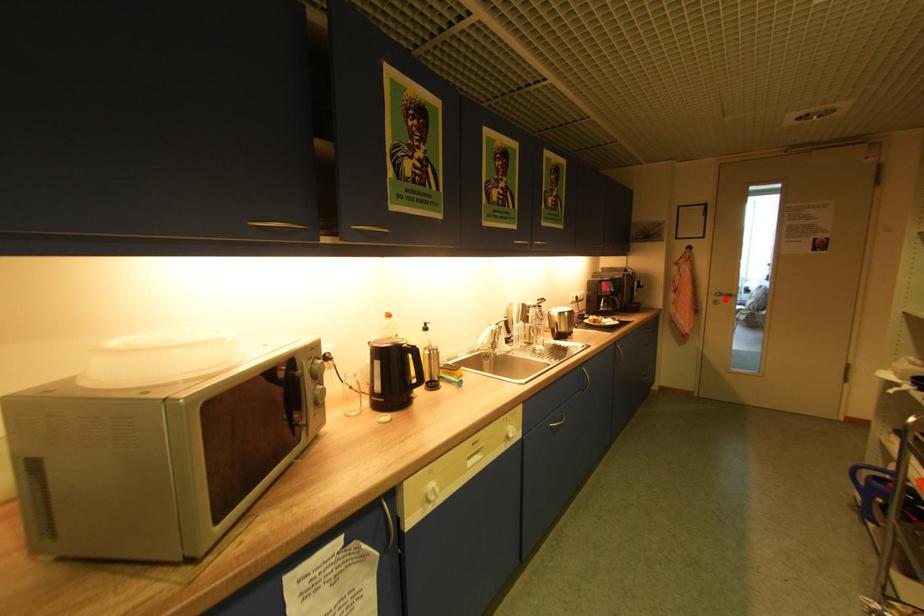
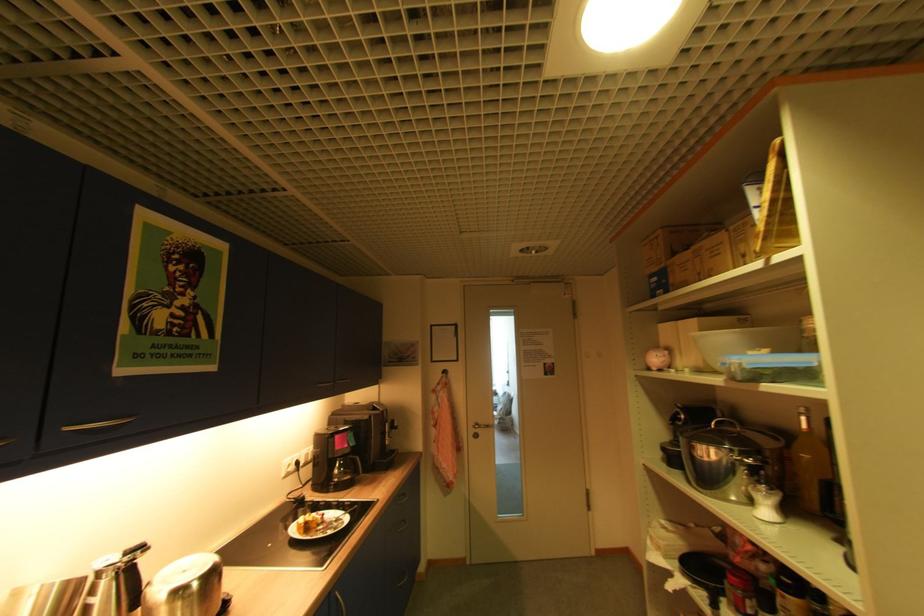
In the second image, find the point that corresponds to the highlighted location in the first image.

(484, 431)